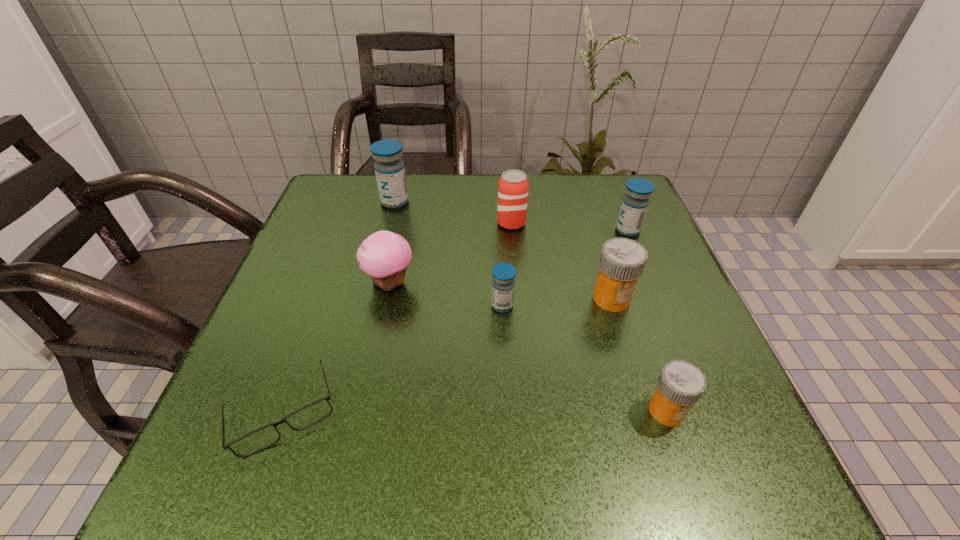
At what (x,y) coordinates should I click in order to perform the action: click on object at the near edge. Please return your answer as a coordinate pair (x, y). Image resolution: width=960 pixels, height=540 pixels. Looking at the image, I should click on (309, 415).

The width and height of the screenshot is (960, 540). I want to click on medicine at the left edge, so click(389, 168).

Image resolution: width=960 pixels, height=540 pixels. Find the location of `spectacles that is at the left edge`. spectacles that is at the left edge is located at coordinates (309, 415).

Where is `object that is positioned at the far left corner`? object that is positioned at the far left corner is located at coordinates (389, 168).

Identify the location of object positioned at the near left corner. The image size is (960, 540). (309, 415).

At what (x,y) coordinates should I click in order to perform the action: click on object present at the far right corner. Please return your answer as a coordinate pair (x, y). Image resolution: width=960 pixels, height=540 pixels. Looking at the image, I should click on (635, 202).

Locate an element on the screen. Image resolution: width=960 pixels, height=540 pixels. vacant position at the far edge of the desktop is located at coordinates click(x=579, y=214).

Image resolution: width=960 pixels, height=540 pixels. What are the coordinates of `vacant space at the near edge of the desktop` in the screenshot? It's located at (461, 484).

This screenshot has height=540, width=960. In the image, there is a desktop. Identify the location of vacant space at the left edge. (343, 292).

In the image, there is a desktop. Where is `vacant region at the right edge`? The width and height of the screenshot is (960, 540). vacant region at the right edge is located at coordinates (633, 388).